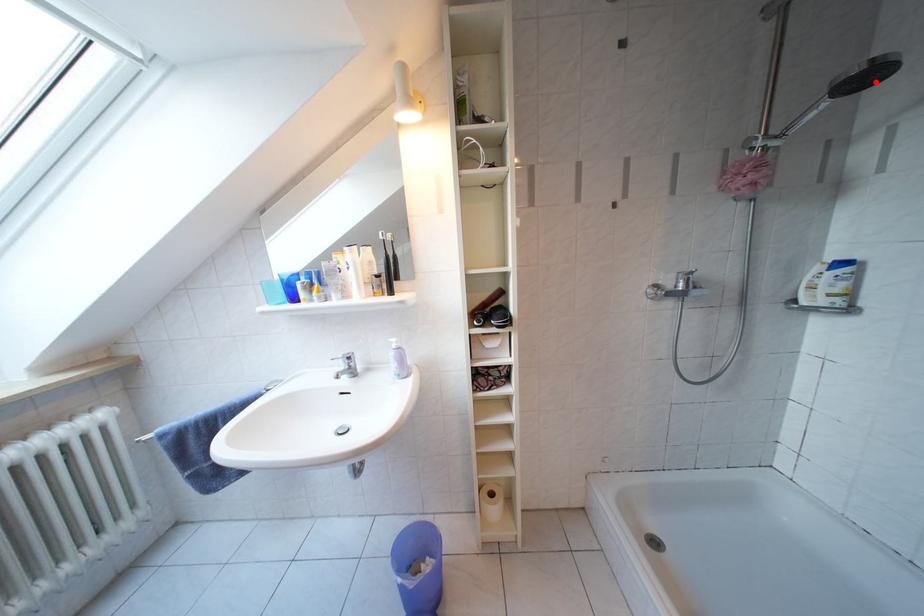
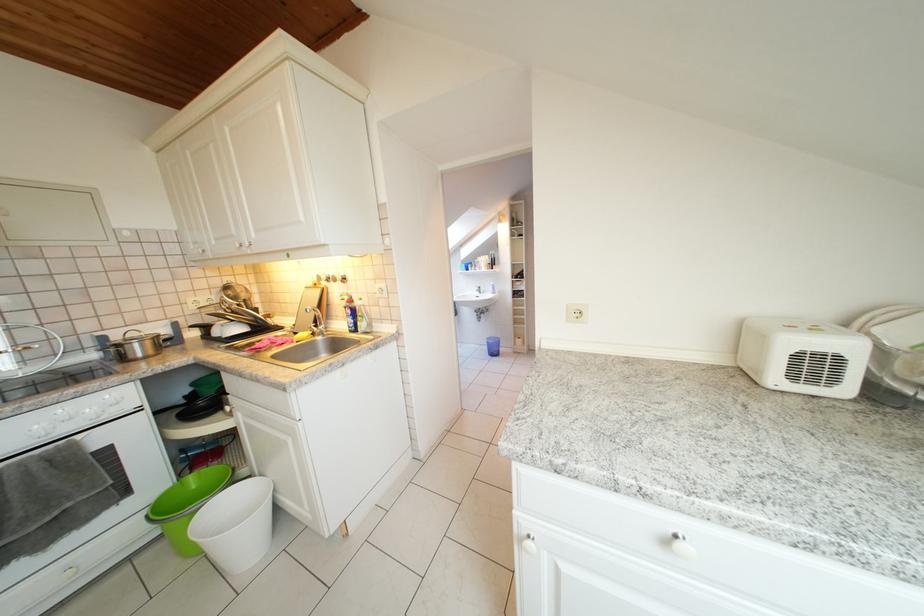
Question: I am providing you with two images of the same scene from different viewpoints. A red point is marked on the first image. Can you still see the location of the red point in image 2?

Choices:
 (A) Yes
 (B) No

Answer: (B)